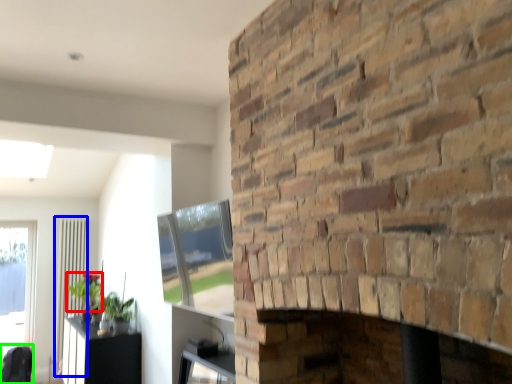
Question: Which object is positioned closest to plant (highlighted by a red box)? Select from screen door (highlighted by a blue box) and swivel chair (highlighted by a green box).

Choices:
 (A) screen door
 (B) swivel chair

Answer: (A)